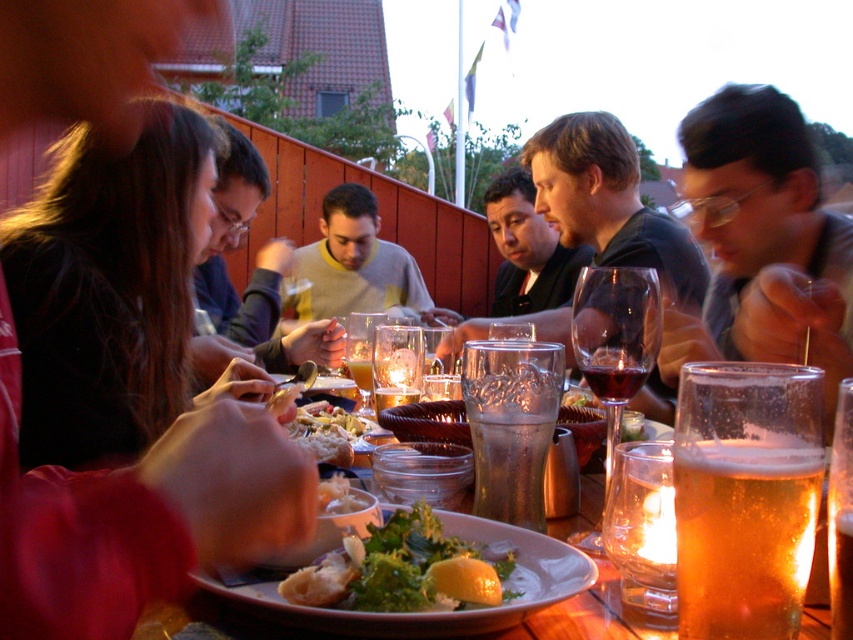
Question: Based on their relative distances, which object is nearer to the light gray sweater at center?

Choices:
 (A) dark red glass at center
 (B) green leafy salad at center
 (C) black shirt at center
 (D) matte black hair at upper right

Answer: (C)

Question: Which object is farther from the camera taking this photo?

Choices:
 (A) dark red glass at center
 (B) light gray sweater at center
 (C) ruby glass at center
 (D) black shirt at center

Answer: (B)

Question: Can you confirm if white creamy pasta at center is thinner than dark red glass at center?

Choices:
 (A) yes
 (B) no

Answer: (B)

Question: Estimate the real-world distances between objects in this image. Which object is closer to the ruby glass at center?

Choices:
 (A) translucent glass beer at table center
 (B) black shirt at center

Answer: (A)

Question: In this image, where is translucent glass plate at center located relative to translucent glass wine glass at center?

Choices:
 (A) below
 (B) above

Answer: (A)

Question: Does green leafy salad at center appear on the right side of light gray sweater at center?

Choices:
 (A) yes
 (B) no

Answer: (A)